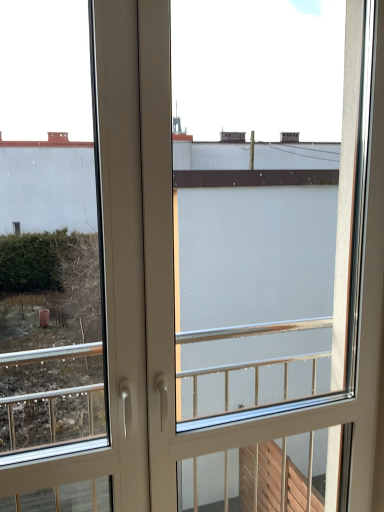
You are a GUI agent. You are given a task and a screenshot of the screen. Output one action in this format:
    pyautogui.click(x=<x>, y=<y>)
    Task: Click on the transparent plastic screen door at center
    The height and width of the screenshot is (512, 384).
    Given the screenshot: What is the action you would take?
    pyautogui.click(x=254, y=276)

The width and height of the screenshot is (384, 512). What do you see at coordinates (254, 276) in the screenshot? I see `transparent plastic screen door at center` at bounding box center [254, 276].

Image resolution: width=384 pixels, height=512 pixels. In order to click on transparent plastic screen door at center in this screenshot , I will do `click(254, 276)`.